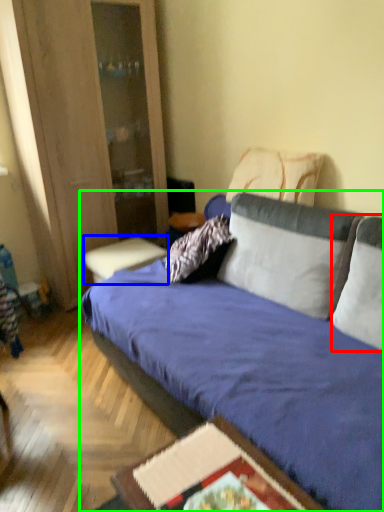
Question: Which is farther away from pillow (highlighted by a red box)? table (highlighted by a blue box) or studio couch (highlighted by a green box)?

Choices:
 (A) table
 (B) studio couch

Answer: (A)